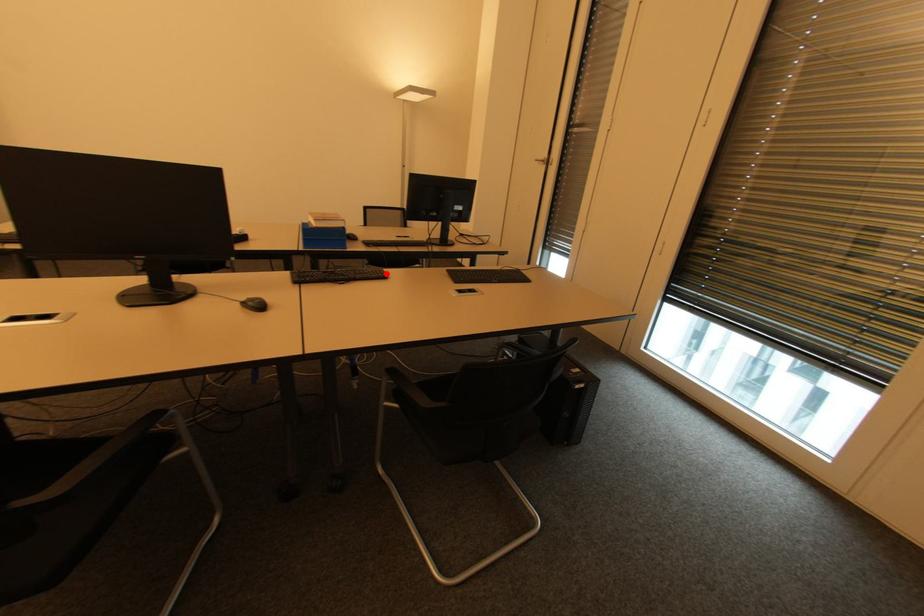
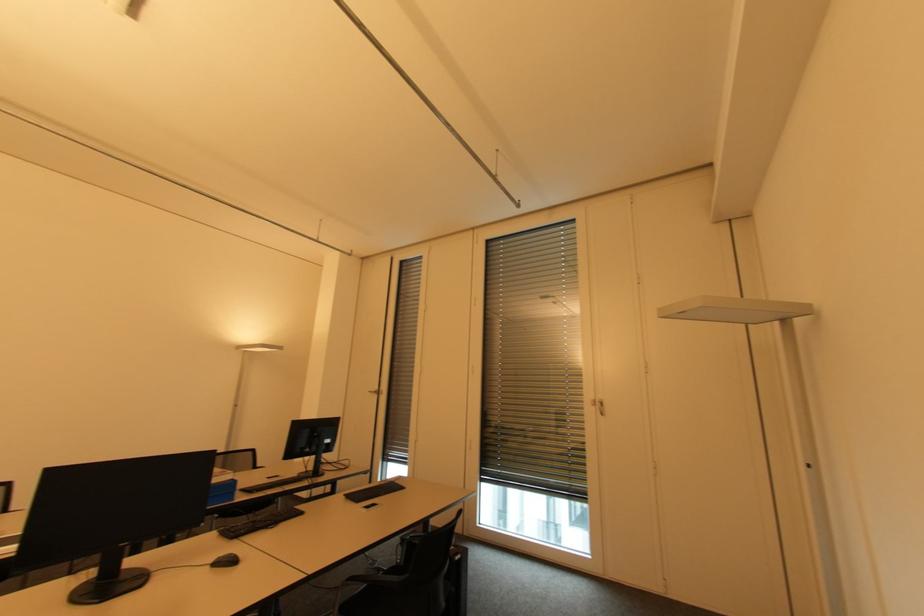
Find the pixel in the second image that matches the highlighted location in the first image.

(300, 511)